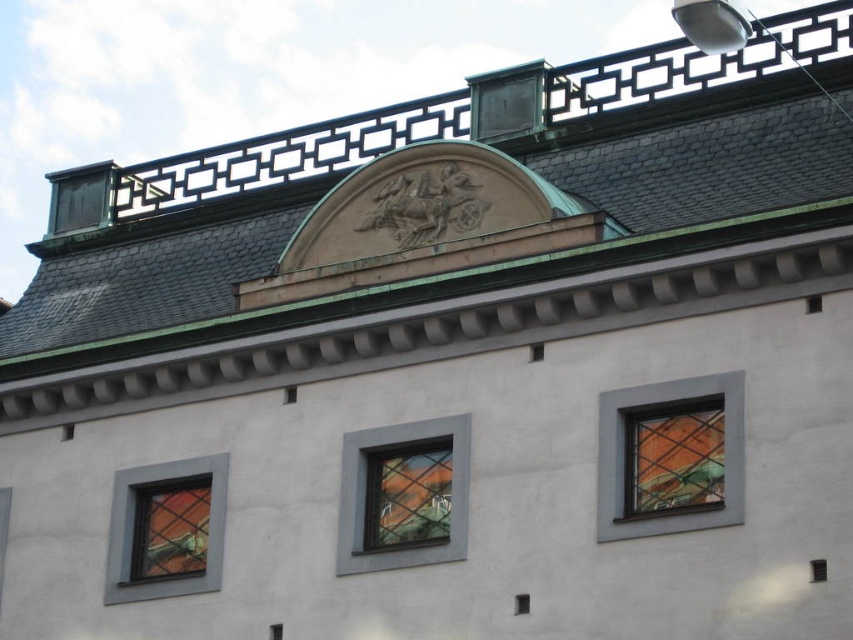
You are an architect examining the building facade. You notice a point at coordinates (407, 496). What object is located at this point?

The transparent glass window at center is located at point (407, 496).

You are an architect evaluating the building facade. You need to determine which window, the clear glass window at center or the matte glass window at lower left, allows more natural light into the building. Based on their descriptions, which one would you choose?

The clear glass window at center has a larger size compared to the matte glass window at lower left. Since it is both larger and made of clear glass, it would allow more natural light into the building.

You are an architect analyzing the building facade. You need to determine the spatial relationship between the transparent glass window at center and the matte glass window at lower left. Which window is located to the right of the other?

The transparent glass window at center is positioned on the right side of matte glass window at lower left.